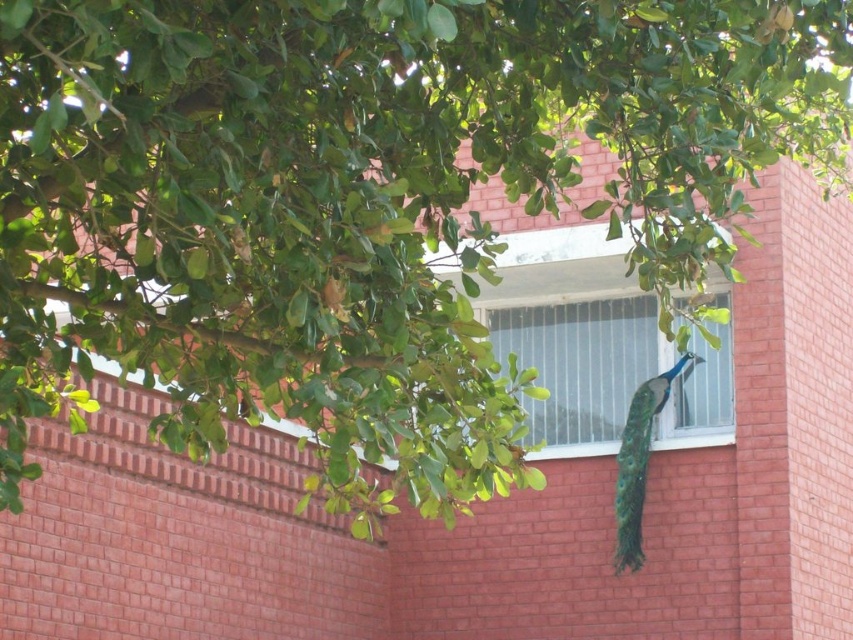
Question: Can you confirm if clear glass window at center is bigger than shiny green peacock tail at center?

Choices:
 (A) no
 (B) yes

Answer: (B)

Question: Which point is farther from the camera taking this photo?

Choices:
 (A) (728, 326)
 (B) (624, 516)

Answer: (A)

Question: Does green iridescent peacock at center have a larger size compared to shiny green peacock tail at center?

Choices:
 (A) yes
 (B) no

Answer: (A)

Question: Based on their relative distances, which object is farther from the shiny green peacock tail at center?

Choices:
 (A) green iridescent peacock at center
 (B) clear glass window at center

Answer: (B)

Question: Which of the following is the closest to the observer?

Choices:
 (A) (650, 417)
 (B) (656, 401)
 (C) (495, 324)

Answer: (A)

Question: Is green iridescent peacock at center to the right of shiny green peacock tail at center from the viewer's perspective?

Choices:
 (A) no
 (B) yes

Answer: (B)